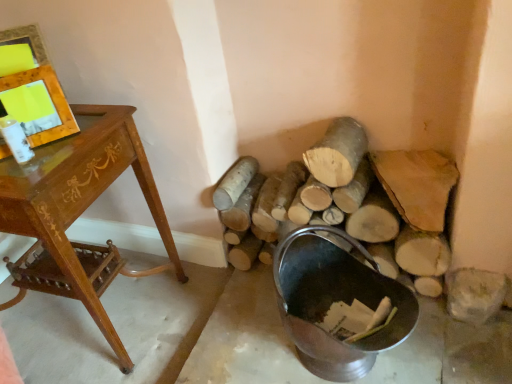
Where is `vacant space underneath wooden desk at left (from a real-world perspective)`? vacant space underneath wooden desk at left (from a real-world perspective) is located at coordinates (109, 310).